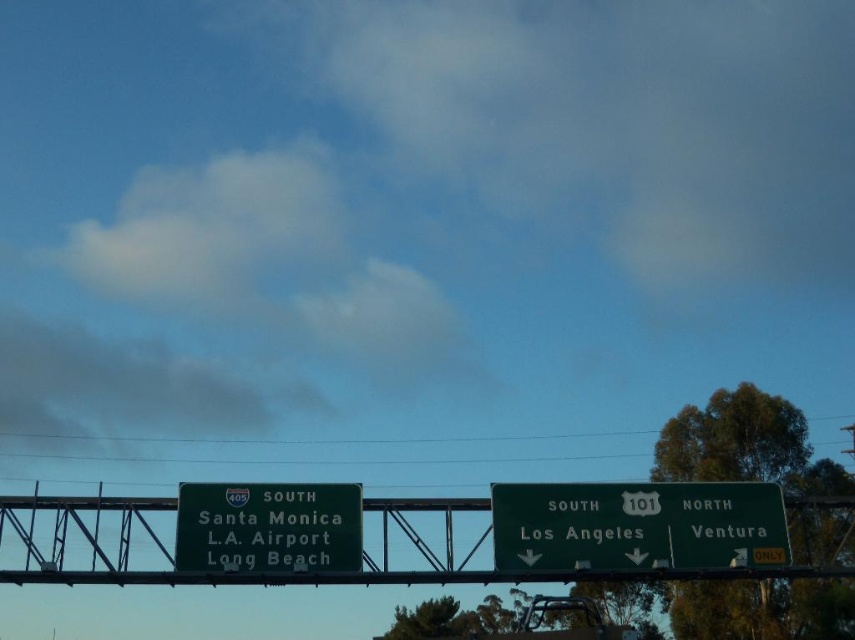
Does green metallic sign at center have a smaller size compared to green matte sign at center?

No.

Is point (162, 572) positioned before point (693, 490)?

Yes, point (162, 572) is in front of point (693, 490).

This screenshot has height=640, width=855. What are the coordinates of `green metallic sign at center` in the screenshot? It's located at tap(275, 572).

Is green metallic sign at center shorter than green metallic sign at lower left?

No, green metallic sign at center is not shorter than green metallic sign at lower left.

Who is more distant from viewer, (817,570) or (261,572)?

Point (817,570)

Where is `green metallic sign at center`? Image resolution: width=855 pixels, height=640 pixels. green metallic sign at center is located at coordinates (275, 572).

The height and width of the screenshot is (640, 855). Describe the element at coordinates (637, 525) in the screenshot. I see `green matte sign at center` at that location.

The width and height of the screenshot is (855, 640). What do you see at coordinates (637, 525) in the screenshot?
I see `green matte sign at center` at bounding box center [637, 525].

Identify the location of green matte sign at center. (637, 525).